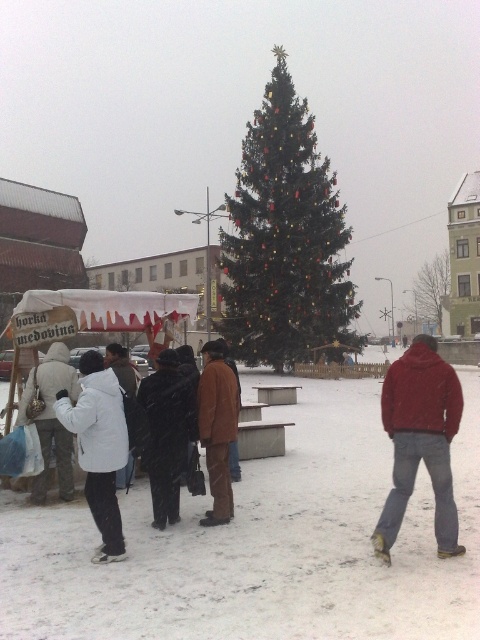
Question: Is green matte christmas tree at center further to the viewer compared to brown leather jacket at center?

Choices:
 (A) yes
 (B) no

Answer: (A)

Question: Where is green matte christmas tree at center located in relation to black wool coat at center in the image?

Choices:
 (A) left
 (B) right

Answer: (B)

Question: Estimate the real-world distances between objects in this image. Which object is closer to the red matte jacket at lower right?

Choices:
 (A) brown leather jacket at center
 (B) green matte christmas tree at center

Answer: (A)

Question: Which point is farther from the camera taking this photo?

Choices:
 (A) (x=83, y=365)
 (B) (x=260, y=317)
 (C) (x=437, y=541)
 (D) (x=144, y=378)

Answer: (B)

Question: Can you confirm if green matte christmas tree at center is smaller than black wool coat at center?

Choices:
 (A) yes
 (B) no

Answer: (B)

Question: Estimate the real-world distances between objects in this image. Which object is farther from the white woolen coat at left?

Choices:
 (A) white matte jacket at left
 (B) brown leather jacket at center

Answer: (A)